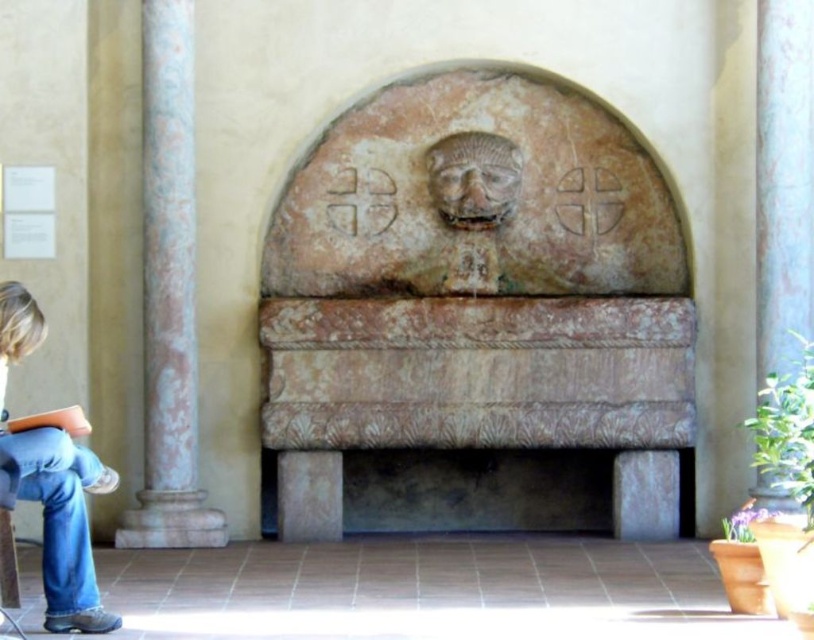
You are standing in the room and want to reach the blue jeans at lower left without moving the rustic stone fountain at center. Is the path clear?

The rustic stone fountain at center is further to the viewer than blue jeans at lower left, meaning the blue jeans are closer to you. Since the fountain is between you and the jeans, the path is blocked by the fountain.

You are standing in the room and want to place a 1.5 meter tall statue between the marble column at right and the blue jeans at lower left. Can the statue fit vertically between them?

The marble column at right is taller than blue jeans at lower left. Since the statue is 1.5 meters tall, it can fit vertically between them as long as the space between the two objects allows for its height.